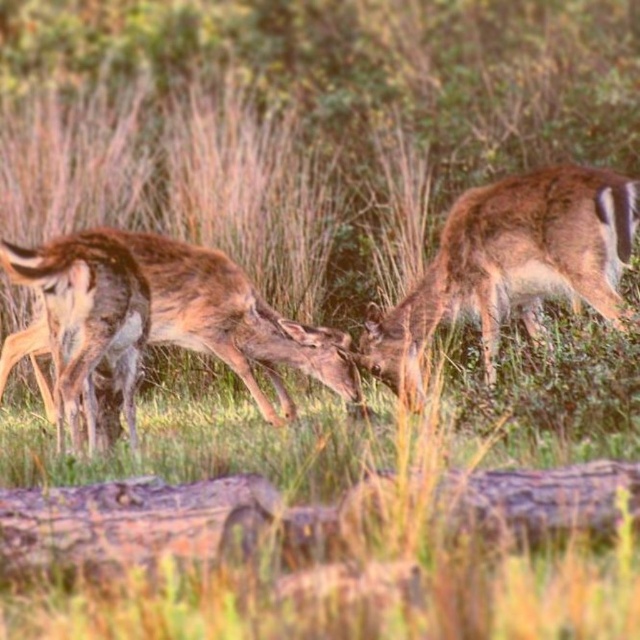
Between wooden log at lower center and brown fur coat at left, which one appears on the left side from the viewer's perspective?

Positioned to the left is brown fur coat at left.

Which is more to the right, wooden log at lower center or brown fur coat at left?

wooden log at lower center is more to the right.

Between point (260, 477) and point (19, 268), which one is positioned in front?

Point (260, 477)

I want to click on wooden log at lower center, so click(x=164, y=520).

Who is taller, brown furry deer at right or brown fur coat at left?

brown furry deer at right

Does brown furry deer at right have a lesser width compared to brown fur coat at left?

No, brown furry deer at right is not thinner than brown fur coat at left.

Who is more distant from viewer, (x=566, y=173) or (x=56, y=424)?

The point (x=566, y=173) is more distant.

Locate an element on the screen. brown furry deer at right is located at coordinates (513, 264).

Does wooden log at lower center have a lesser width compared to brown fur deer at center?

Indeed, wooden log at lower center has a lesser width compared to brown fur deer at center.

Does point (580, 513) lie behind point (243, 300)?

No, it is in front of (243, 300).

Find the location of a particular element. This screenshot has width=640, height=640. wooden log at lower center is located at coordinates (164, 520).

You are a GUI agent. You are given a task and a screenshot of the screen. Output one action in this format:
    pyautogui.click(x=<x>, y=<y>)
    Task: Click on the wooden log at lower center
    The width and height of the screenshot is (640, 640).
    Given the screenshot: What is the action you would take?
    pyautogui.click(x=164, y=520)